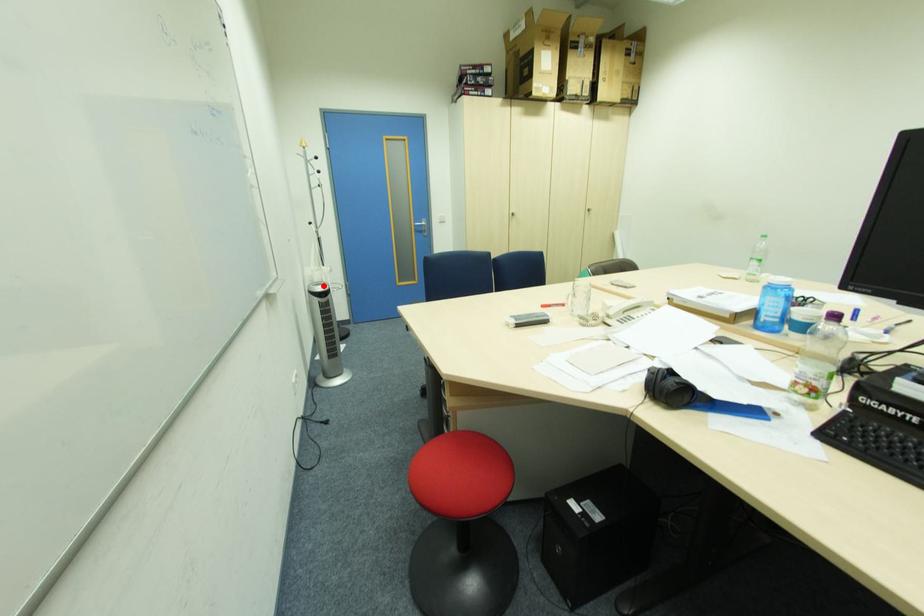
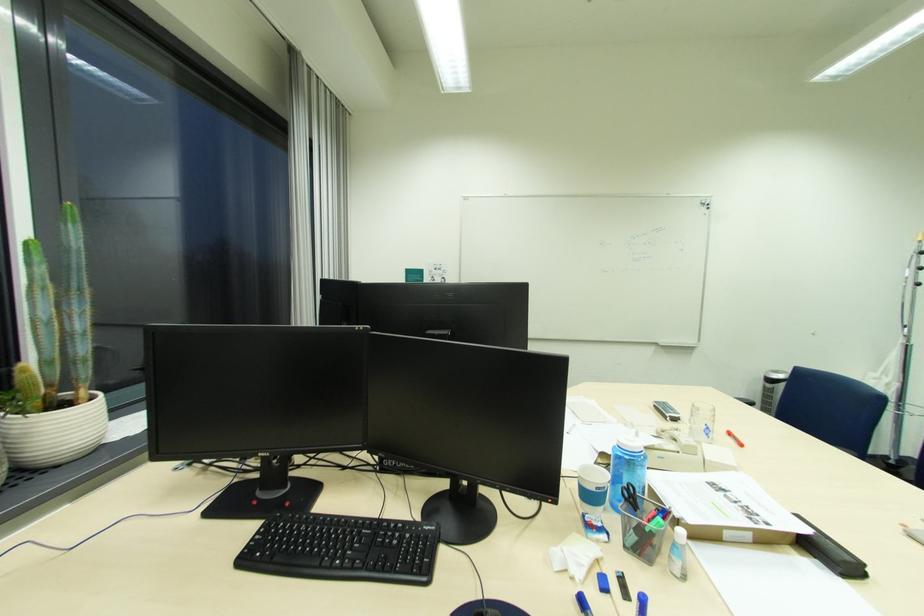
The point at the highlighted location is marked in the first image. Where is the corresponding point in the second image?

(782, 373)